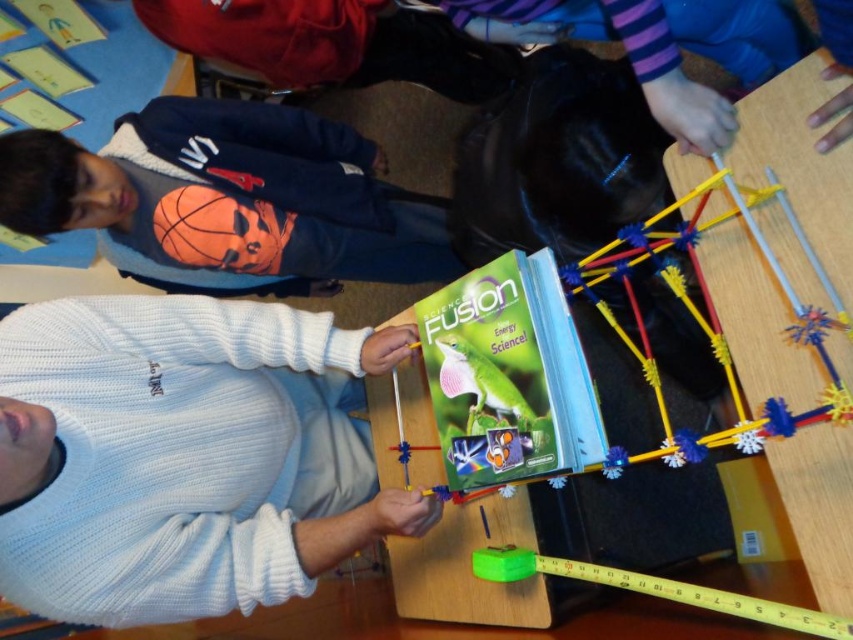
Question: Among these objects, which one is nearest to the camera?

Choices:
 (A) white knitted sweater at center
 (B) matte blue sweatshirt at left

Answer: (A)

Question: Is matte blue sweatshirt at left wider than orange matte basketball at center?

Choices:
 (A) yes
 (B) no

Answer: (A)

Question: Can you confirm if white knitted sweater at center is positioned below matte blue sweatshirt at left?

Choices:
 (A) no
 (B) yes

Answer: (B)

Question: Does matte blue sweatshirt at left have a greater width compared to orange matte basketball at center?

Choices:
 (A) no
 (B) yes

Answer: (B)

Question: Which of the following is the farthest from the observer?

Choices:
 (A) (32, 572)
 (B) (247, 227)
 (C) (297, 260)

Answer: (C)

Question: Which of these objects is positioned closest to the matte blue sweatshirt at left?

Choices:
 (A) orange matte basketball at center
 (B) white knitted sweater at center

Answer: (A)